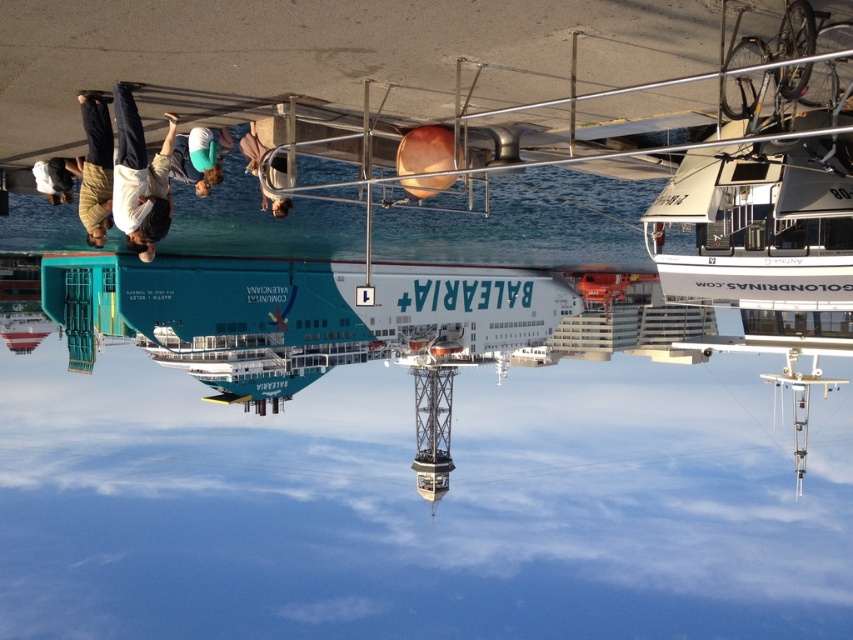
The height and width of the screenshot is (640, 853). I want to click on light brown shirt at upper left, so click(x=135, y=180).

Identify the location of light brown shirt at upper left. (135, 180).

From the picture: Is brown leather jacket at upper left bigger than green fabric shirt at center?

Yes.

Is brown leather jacket at upper left to the right of green fabric shirt at center from the viewer's perspective?

Incorrect, brown leather jacket at upper left is not on the right side of green fabric shirt at center.

You are a GUI agent. You are given a task and a screenshot of the screen. Output one action in this format:
    pyautogui.click(x=<x>, y=<y>)
    Task: Click on the brown leather jacket at upper left
    
    Given the screenshot: What is the action you would take?
    pyautogui.click(x=96, y=170)

Describe the element at coordinates (199, 157) in the screenshot. I see `green fabric shirt at center` at that location.

Find the location of a particular element. The height and width of the screenshot is (640, 853). green fabric shirt at center is located at coordinates (199, 157).